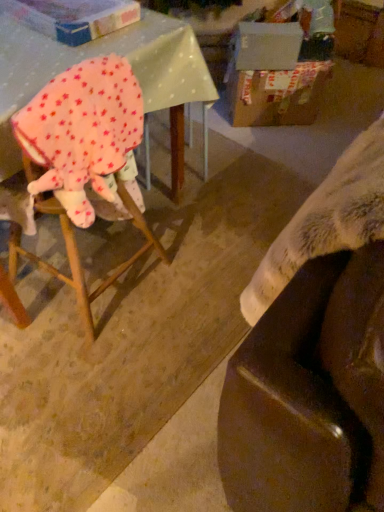
This screenshot has height=512, width=384. Find the location of `free spot to the right of wooden chair at left`. free spot to the right of wooden chair at left is located at coordinates (199, 295).